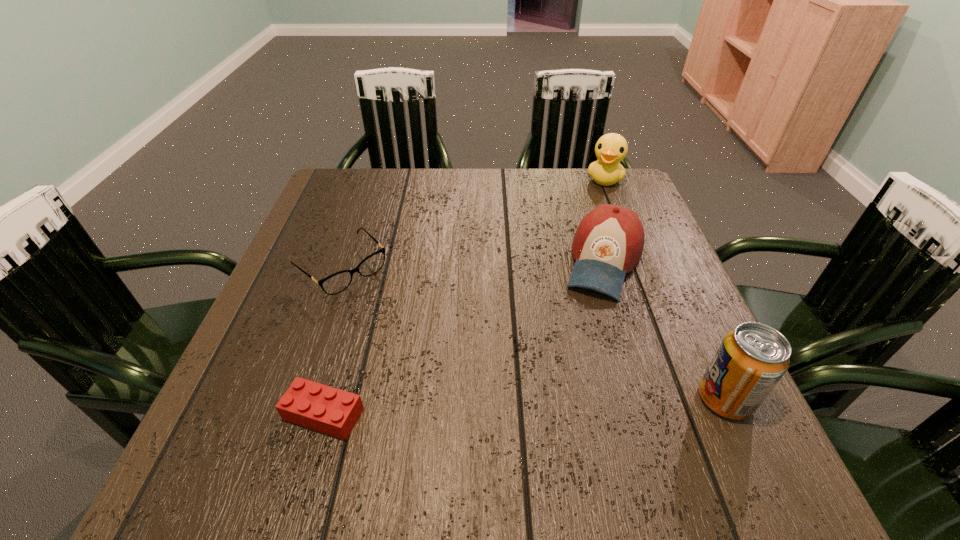
Identify the location of spectacles located in the left edge section of the desktop. (335, 283).

The image size is (960, 540). Find the location of `soda can at the right edge`. soda can at the right edge is located at coordinates (752, 358).

Locate an element on the screen. The width and height of the screenshot is (960, 540). baseball cap that is positioned at the right edge is located at coordinates (608, 243).

Find the location of a particular element. duck that is at the right edge is located at coordinates (611, 149).

Identify the location of object present at the near left corner. (322, 408).

The height and width of the screenshot is (540, 960). Identify the location of object that is positioned at the far right corner. (611, 149).

Locate an element on the screen. The height and width of the screenshot is (540, 960). object that is at the near right corner is located at coordinates (752, 358).

In the image, there is a desktop. At what (x,y) coordinates should I click in order to perform the action: click on vacant space at the far edge. Please return your answer as a coordinate pair (x, y). The height and width of the screenshot is (540, 960). Looking at the image, I should click on (566, 206).

Identify the location of free space at the left edge of the desktop. Image resolution: width=960 pixels, height=540 pixels. (304, 373).

This screenshot has width=960, height=540. I want to click on free spot at the right edge of the desktop, so click(x=632, y=345).